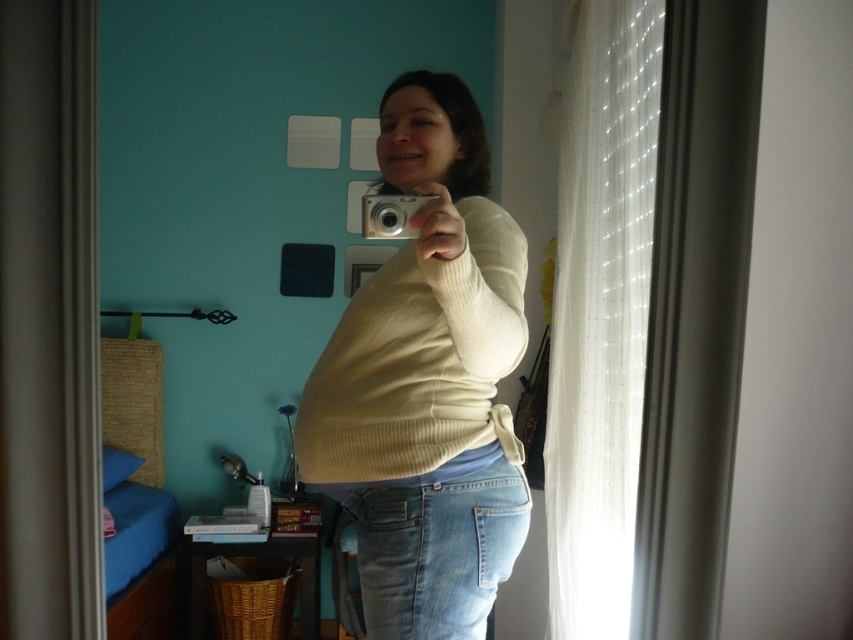
Question: Observing the image, what is the correct spatial positioning of white ribbed sweater at center in reference to white sheer curtain at right?

Choices:
 (A) right
 (B) left

Answer: (B)

Question: Which point appears closest to the camera in this image?

Choices:
 (A) (440, 563)
 (B) (509, 520)
 (C) (366, 200)

Answer: (C)

Question: Estimate the real-world distances between objects in this image. Which object is farther from the white sheer curtain at right?

Choices:
 (A) white ribbed sweater at center
 (B) silver metallic camera at center
 (C) light blue denim jeans at lower center

Answer: (B)

Question: Is white sheer curtain at right below silver metallic camera at center?

Choices:
 (A) yes
 (B) no

Answer: (A)

Question: Estimate the real-world distances between objects in this image. Which object is farther from the silver metallic camera at center?

Choices:
 (A) white ribbed sweater at center
 (B) light blue denim jeans at lower center
 (C) white sheer curtain at right

Answer: (C)

Question: Does white sheer curtain at right appear over light blue denim jeans at lower center?

Choices:
 (A) no
 (B) yes

Answer: (B)